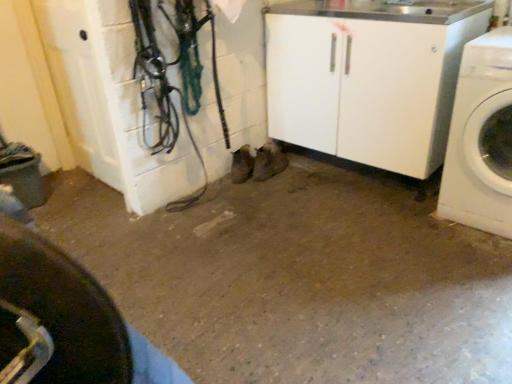
Question: Considering the positions of black rubber tire at lower left and white glossy washing machine at right in the image, is black rubber tire at lower left taller or shorter than white glossy washing machine at right?

Choices:
 (A) short
 (B) tall

Answer: (A)

Question: In terms of width, does black rubber tire at lower left look wider or thinner when compared to white glossy washing machine at right?

Choices:
 (A) wide
 (B) thin

Answer: (B)

Question: From the image's perspective, is black rubber tire at lower left positioned above or below white glossy washing machine at right?

Choices:
 (A) below
 (B) above

Answer: (A)

Question: In terms of size, does white glossy washing machine at right appear bigger or smaller than black rubber tire at lower left?

Choices:
 (A) big
 (B) small

Answer: (A)

Question: In the image, is white glossy washing machine at right positioned in front of or behind black rubber tire at lower left?

Choices:
 (A) front
 (B) behind

Answer: (B)

Question: In terms of height, does white glossy washing machine at right look taller or shorter compared to black rubber tire at lower left?

Choices:
 (A) tall
 (B) short

Answer: (A)

Question: Is white glossy washing machine at right spatially inside black rubber tire at lower left, or outside of it?

Choices:
 (A) inside
 (B) outside

Answer: (B)